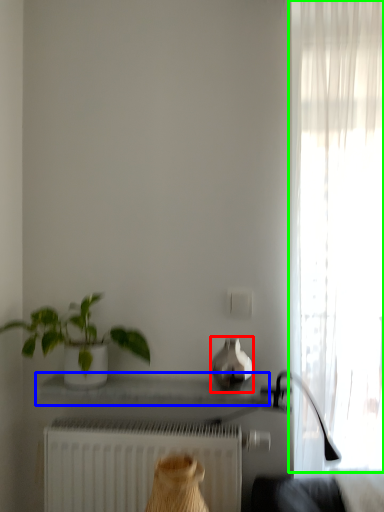
Question: Which is nearer to the vase (highlighted by a red box)? window sill (highlighted by a blue box) or curtain (highlighted by a green box).

Choices:
 (A) window sill
 (B) curtain

Answer: (A)